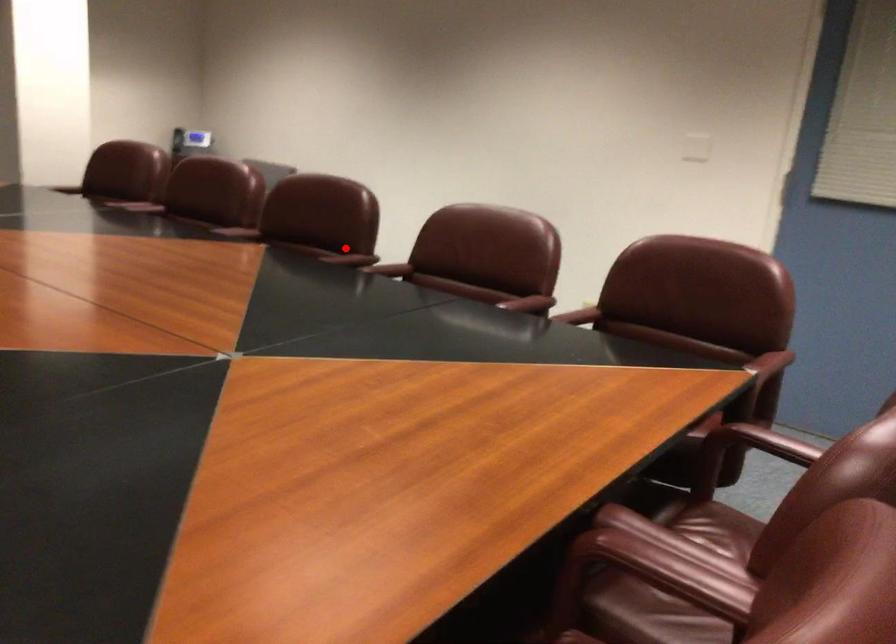
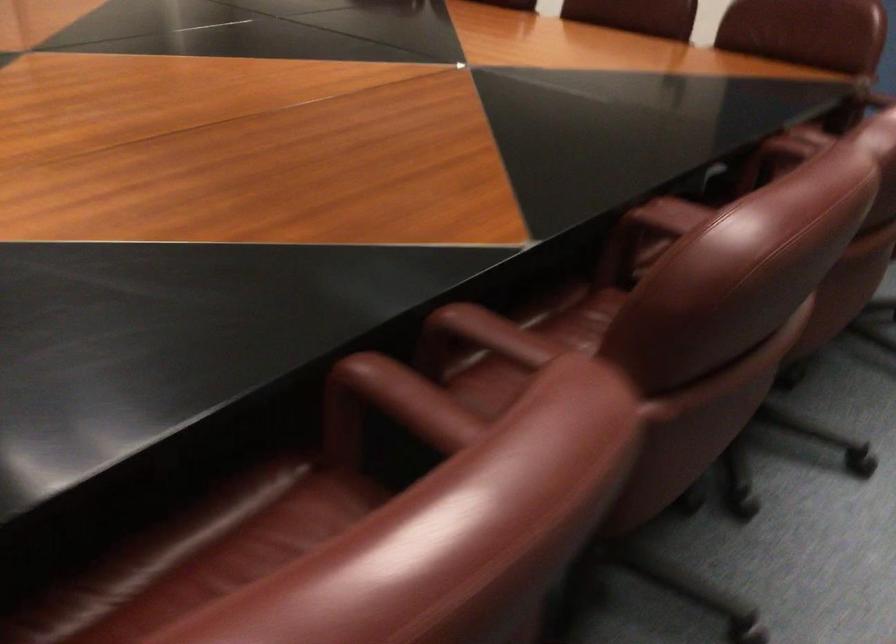
Question: I am providing you with two images of the same scene from different viewpoints. A red point is shown in image1. For the corresponding object point in image2, is it positioned nearer or farther from the camera?

Choices:
 (A) Nearer
 (B) Farther

Answer: (A)